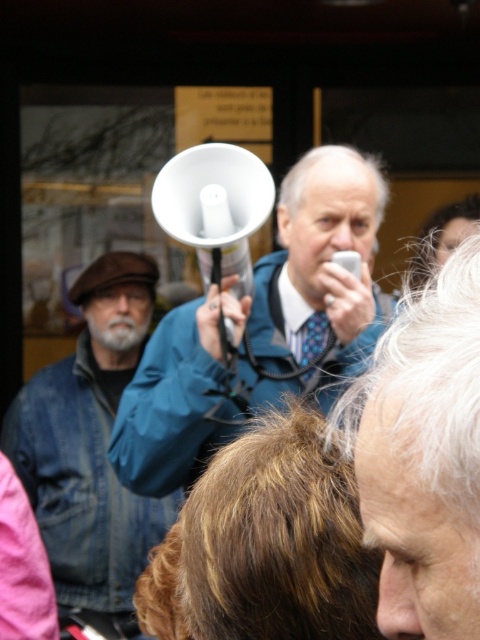
Question: Among these points, which one is nearest to the camera?

Choices:
 (A) (223, 296)
 (B) (132, 554)
 (C) (383, 337)

Answer: (C)

Question: Where is smooth blue jacket at center located in relation to denim jacket at left in the image?

Choices:
 (A) above
 (B) below

Answer: (A)

Question: Which object is the closest to the smooth blue jacket at center?

Choices:
 (A) white plastic megaphone at center
 (B) denim jacket at left

Answer: (A)

Question: Can you confirm if smooth blue jacket at center is smaller than denim jacket at left?

Choices:
 (A) yes
 (B) no

Answer: (A)

Question: Does smooth blue jacket at center appear over denim jacket at left?

Choices:
 (A) no
 (B) yes

Answer: (B)

Question: Based on their relative distances, which object is nearer to the smooth blue jacket at center?

Choices:
 (A) denim jacket at left
 (B) white plastic megaphone at center

Answer: (B)